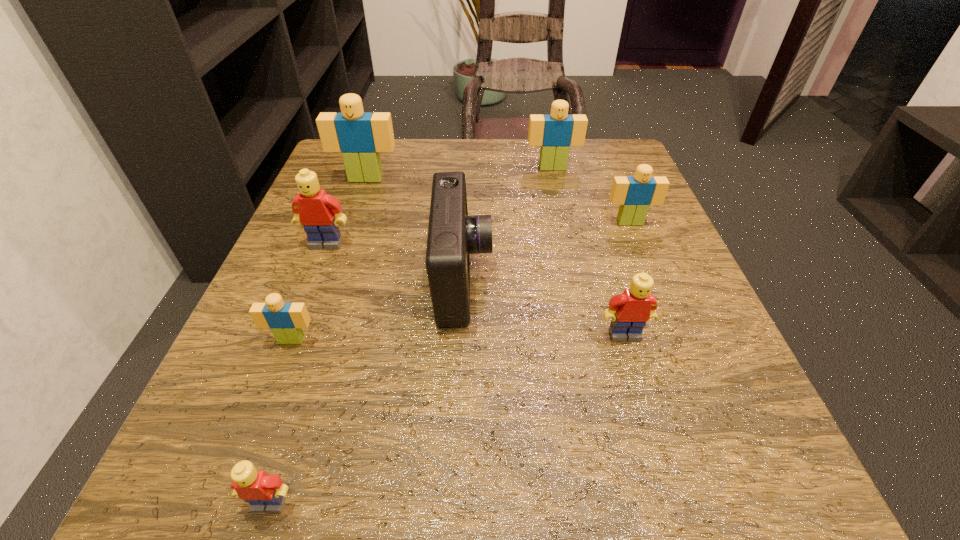
I want to click on the seventh nearest object, so click(360, 136).

You are a GUI agent. You are given a task and a screenshot of the screen. Output one action in this format:
    pyautogui.click(x=<x>, y=<y>)
    Task: Click on the biggest beige Lego
    Image resolution: width=960 pixels, height=540 pixels.
    Given the screenshot: What is the action you would take?
    pyautogui.click(x=360, y=136)

This screenshot has height=540, width=960. I want to click on the second biggest beige Lego, so click(555, 133).

Locate an element on the screen. The width and height of the screenshot is (960, 540). the second beige Lego from right to left is located at coordinates (555, 133).

Where is `the fourth nearest Lego`? The height and width of the screenshot is (540, 960). the fourth nearest Lego is located at coordinates (314, 209).

Locate an element on the screen. The image size is (960, 540). the biggest yellow Lego is located at coordinates (314, 209).

Where is `the fifth object from left to right`? The width and height of the screenshot is (960, 540). the fifth object from left to right is located at coordinates (452, 235).

Find the location of a particular element. blue camera is located at coordinates (452, 235).

The image size is (960, 540). Identify the location of the second nearest beige Lego. (634, 194).

This screenshot has width=960, height=540. Identify the location of the rightmost beige Lego. (x=634, y=194).